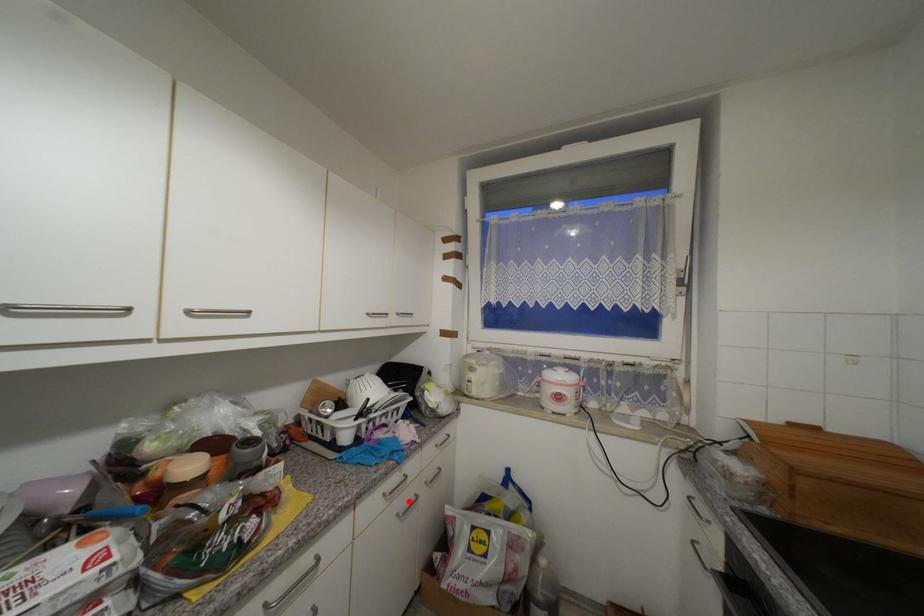
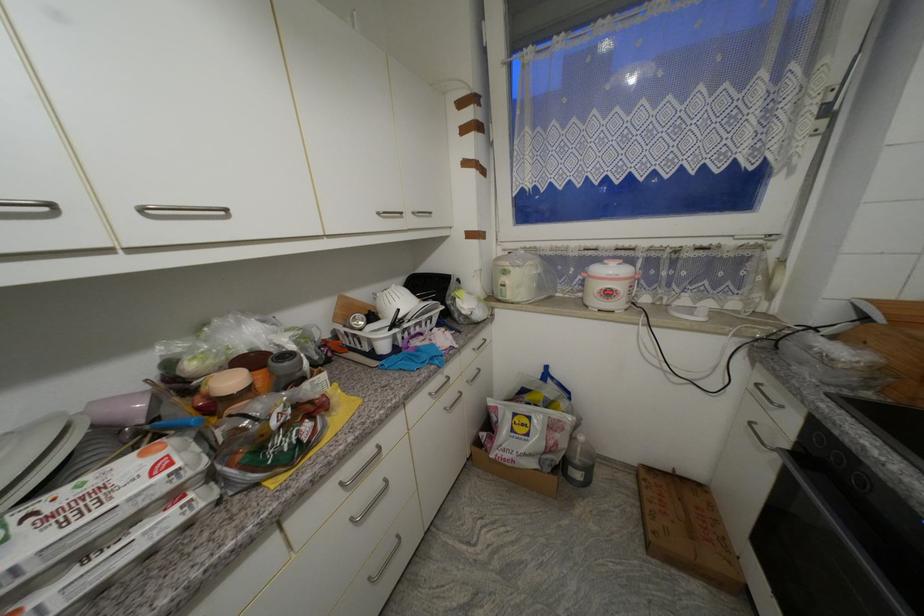
In the second image, find the point that corresponds to the highlighted location in the first image.

(455, 398)